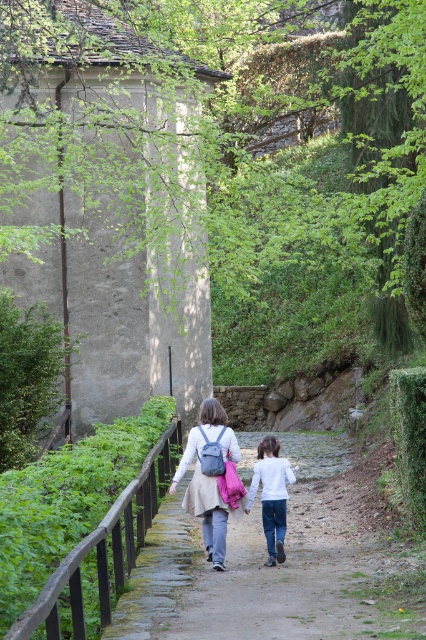
Question: Which object is the closest to the matte blue backpack at center?

Choices:
 (A) white matte shirt at center
 (B) smooth stone path at center

Answer: (A)

Question: Can you confirm if smooth stone path at center is positioned to the left of matte blue backpack at center?

Choices:
 (A) yes
 (B) no

Answer: (B)

Question: Among these objects, which one is nearest to the camera?

Choices:
 (A) smooth stone path at center
 (B) white matte shirt at center
 (C) matte blue backpack at center

Answer: (A)

Question: Considering the relative positions of smooth stone path at center and matte blue backpack at center in the image provided, where is smooth stone path at center located with respect to matte blue backpack at center?

Choices:
 (A) left
 (B) right

Answer: (B)

Question: Is smooth stone path at center below matte blue backpack at center?

Choices:
 (A) yes
 (B) no

Answer: (A)

Question: Which object is the farthest from the matte blue backpack at center?

Choices:
 (A) smooth stone path at center
 (B) white matte shirt at center

Answer: (A)